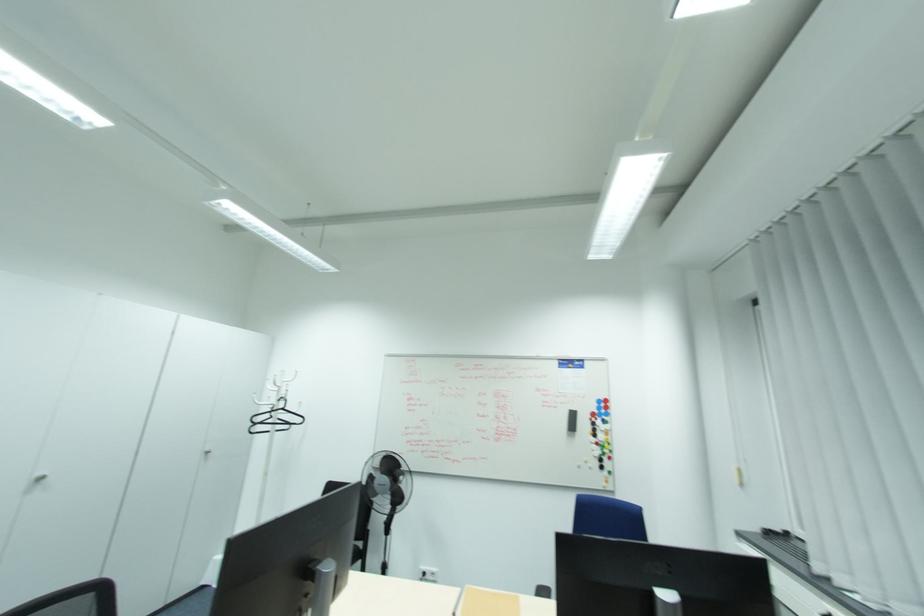
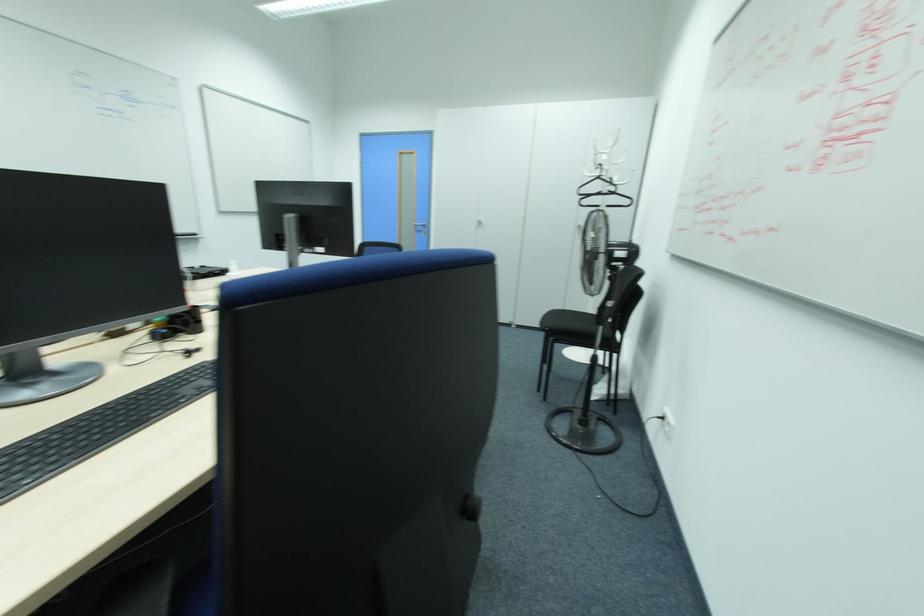
The point at (284, 408) is marked in the first image. Where is the corresponding point in the second image?

(599, 177)